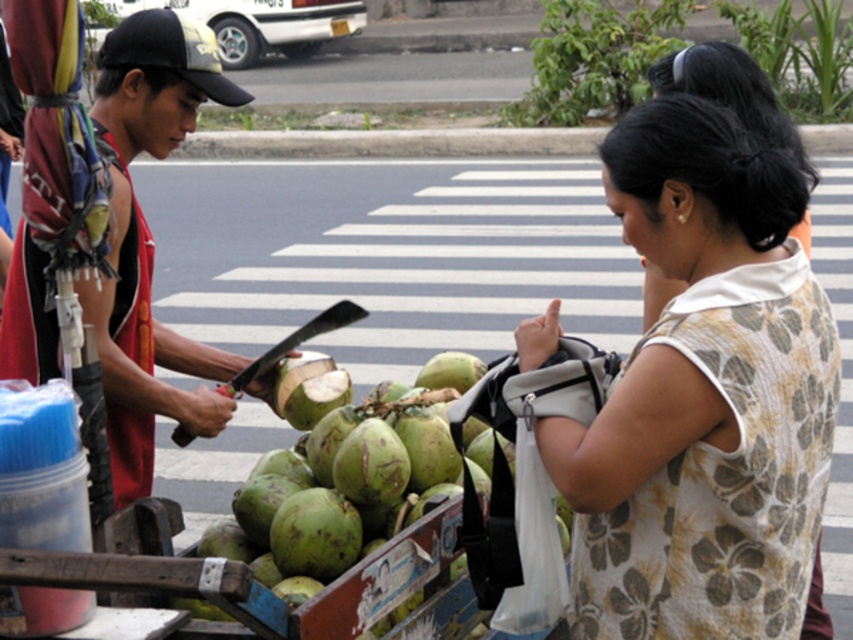
Question: Does reddish-brown fabric vest at left have a larger size compared to green rough coconut at center?

Choices:
 (A) no
 (B) yes

Answer: (B)

Question: Which is nearer to the green rough coconut at center?

Choices:
 (A) floral-patterned sleeveless top at upper right
 (B) reddish-brown fabric vest at left

Answer: (B)

Question: Which of the following is the closest to the observer?

Choices:
 (A) floral-patterned sleeveless top at upper right
 (B) reddish-brown fabric vest at left
 (C) green rough coconut at center

Answer: (A)

Question: Based on their relative distances, which object is farther from the reddish-brown fabric vest at left?

Choices:
 (A) floral-patterned sleeveless top at upper right
 (B) green rough coconut at center

Answer: (A)

Question: Is reddish-brown fabric vest at left to the left of green rough coconut at center from the viewer's perspective?

Choices:
 (A) yes
 (B) no

Answer: (A)

Question: Does floral-patterned sleeveless top at upper right appear over reddish-brown fabric vest at left?

Choices:
 (A) no
 (B) yes

Answer: (A)